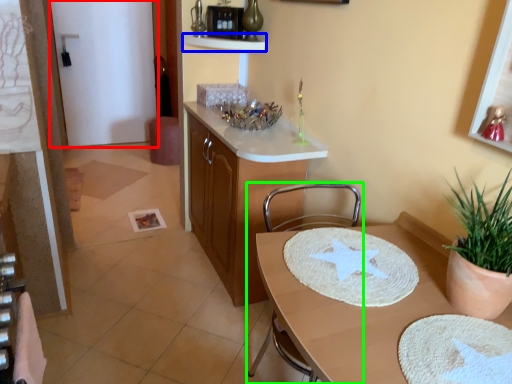
Question: Estimate the real-world distances between objects in this image. Which object is farther from glass door (highlighted by a red box), shelf (highlighted by a blue box) or chair (highlighted by a green box)?

Choices:
 (A) shelf
 (B) chair

Answer: (B)